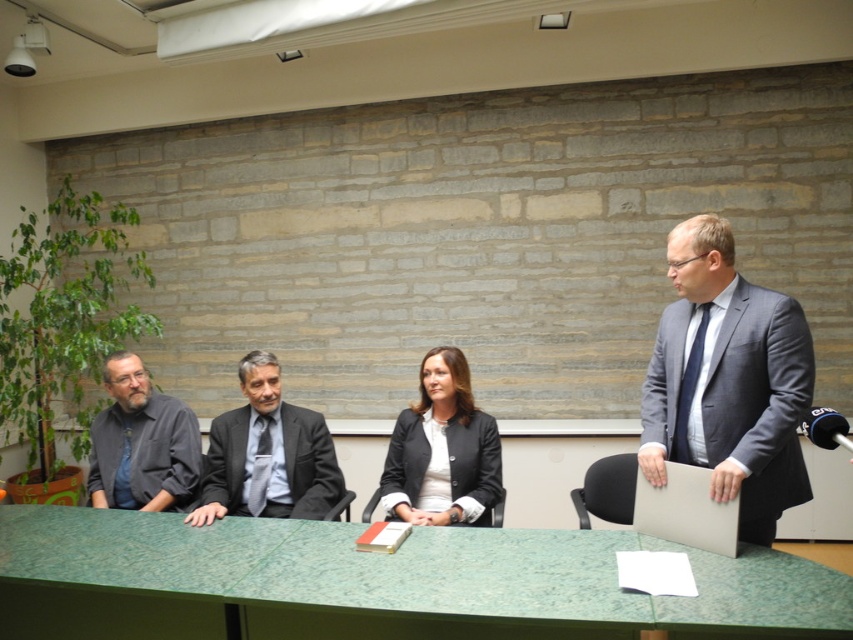
Can you confirm if green marble table at center is positioned to the left of gray suit at right?

Correct, you'll find green marble table at center to the left of gray suit at right.

Does green marble table at center appear under gray suit at right?

Yes.

Who is more forward, [132,580] or [737,348]?

Point [132,580] is in front.

Locate an element on the screen. This screenshot has width=853, height=640. green marble table at center is located at coordinates (380, 582).

Which of these two, matte black blazer at center or matte gray laptop at right, stands shorter?

With less height is matte gray laptop at right.

Is point (419, 384) closer to viewer compared to point (718, 536)?

No, (419, 384) is further to viewer.

Find the location of `matte black blazer at center`. matte black blazer at center is located at coordinates (442, 451).

Does green marble table at center appear over dark gray shirt at left?

Incorrect, green marble table at center is not positioned above dark gray shirt at left.

Does green marble table at center appear on the left side of dark gray shirt at left?

Incorrect, green marble table at center is not on the left side of dark gray shirt at left.

Does point (793, 604) come farther from viewer compared to point (146, 508)?

No, it is not.

Locate an element on the screen. The height and width of the screenshot is (640, 853). green marble table at center is located at coordinates (380, 582).